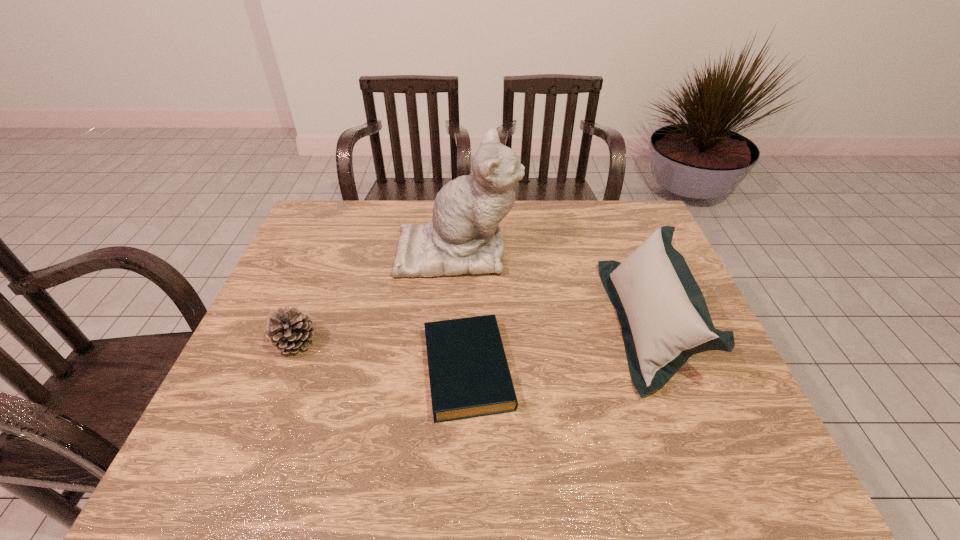
In the image, there is a desktop. Where is `vacant region at the near right corner`? Image resolution: width=960 pixels, height=540 pixels. vacant region at the near right corner is located at coordinates pyautogui.click(x=703, y=484).

Locate an element on the screen. free spot between the third tallest object and the shortest object is located at coordinates (382, 356).

Locate an element on the screen. The image size is (960, 540). unoccupied position between the third shortest object and the tallest object is located at coordinates (553, 287).

This screenshot has width=960, height=540. In order to click on vacant space that is in between the third shortest object and the cat in this screenshot , I will do `click(553, 287)`.

You are a GUI agent. You are given a task and a screenshot of the screen. Output one action in this format:
    pyautogui.click(x=<x>, y=<y>)
    Task: Click on the unoccupied position between the leftmost object and the tallest object
    Image resolution: width=960 pixels, height=540 pixels.
    Given the screenshot: What is the action you would take?
    pyautogui.click(x=376, y=297)

In order to click on vacant space that is in between the cushion and the tallest object in this screenshot , I will do (553, 287).

Find the location of `free space between the cat and the pinecone`. free space between the cat and the pinecone is located at coordinates (376, 297).

Identify the location of vacant space that is in between the book and the second tallest object. (558, 347).

The width and height of the screenshot is (960, 540). Find the location of `free space between the book and the pinecone`. free space between the book and the pinecone is located at coordinates (382, 356).

Image resolution: width=960 pixels, height=540 pixels. In order to click on free space between the book and the second shortest object in this screenshot , I will do `click(382, 356)`.